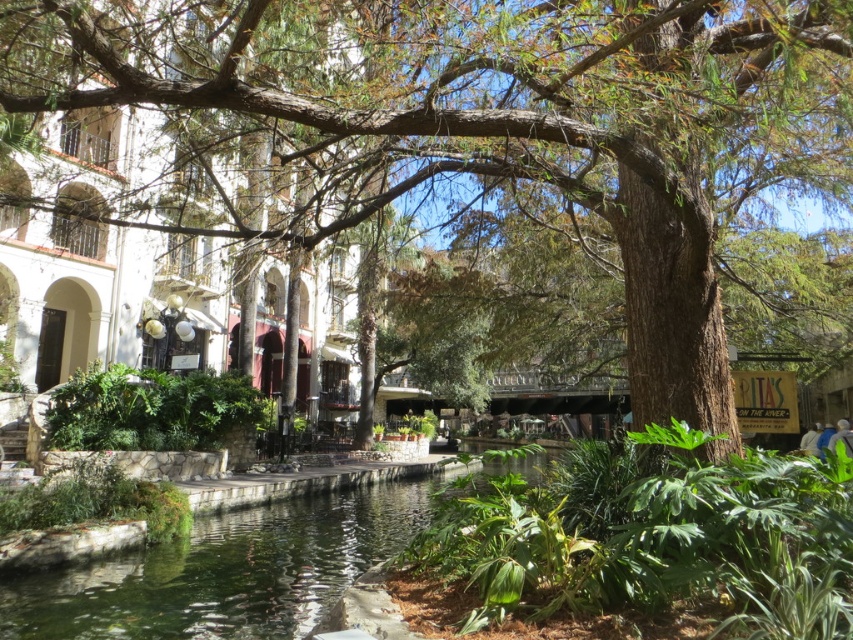
Question: Is brown textured tree at center thinner than green liquid water at center?

Choices:
 (A) no
 (B) yes

Answer: (B)

Question: Which point is closer to the camera?

Choices:
 (A) green liquid water at center
 (B) brown textured tree at center

Answer: (B)

Question: Does brown textured tree at center appear over green liquid water at center?

Choices:
 (A) no
 (B) yes

Answer: (B)

Question: Which point is farther to the camera?

Choices:
 (A) brown textured tree at center
 (B) green liquid water at center

Answer: (B)

Question: Which object is closer to the camera taking this photo?

Choices:
 (A) brown textured tree at center
 (B) green liquid water at center

Answer: (A)

Question: Does brown textured tree at center appear over green liquid water at center?

Choices:
 (A) no
 (B) yes

Answer: (B)